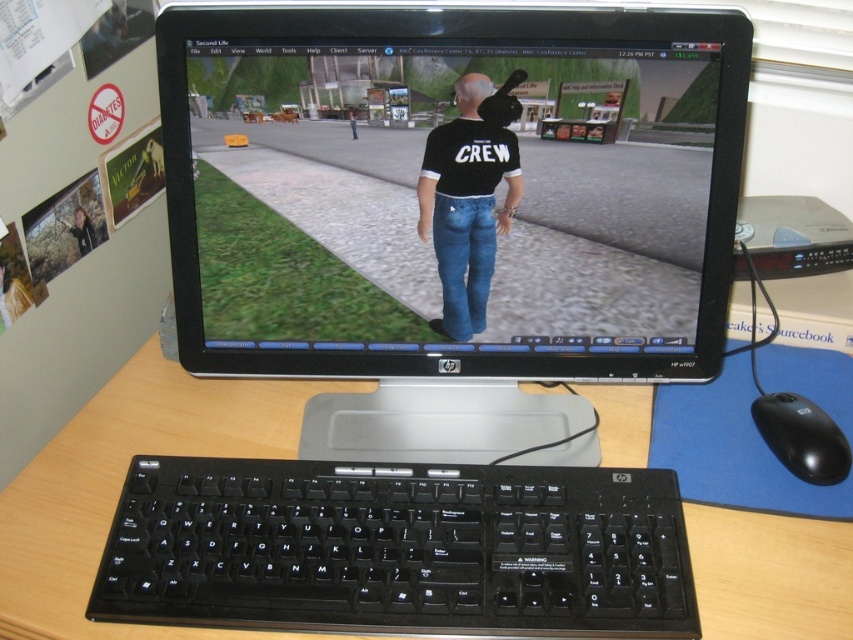
Who is shorter, black plastic keyboard at lower center or black plastic mouse at lower right?

With less height is black plastic mouse at lower right.

Can you confirm if black plastic keyboard at lower center is bigger than black plastic mouse at lower right?

Yes, black plastic keyboard at lower center is bigger than black plastic mouse at lower right.

Is point (357, 579) less distant than point (792, 417)?

Yes, it is.

The width and height of the screenshot is (853, 640). I want to click on black plastic keyboard at lower center, so click(x=397, y=548).

Between black plastic keyboard at lower center and black matte shirt at center, which one is positioned higher?

Positioned higher is black matte shirt at center.

Between black plastic keyboard at lower center and black matte shirt at center, which one has more height?

Standing taller between the two is black matte shirt at center.

Which is in front, point (109, 544) or point (463, 157)?

Point (109, 544) is more forward.

Find the location of a particular element. This screenshot has height=640, width=853. black plastic keyboard at lower center is located at coordinates (397, 548).

Is the position of black matte shirt at center more distant than that of black plastic mouse at lower right?

No, black matte shirt at center is in front of black plastic mouse at lower right.

Does black matte shirt at center have a lesser height compared to black plastic mouse at lower right?

Incorrect, black matte shirt at center's height does not fall short of black plastic mouse at lower right's.

The width and height of the screenshot is (853, 640). What are the coordinates of `black matte shirt at center` in the screenshot? It's located at 469,196.